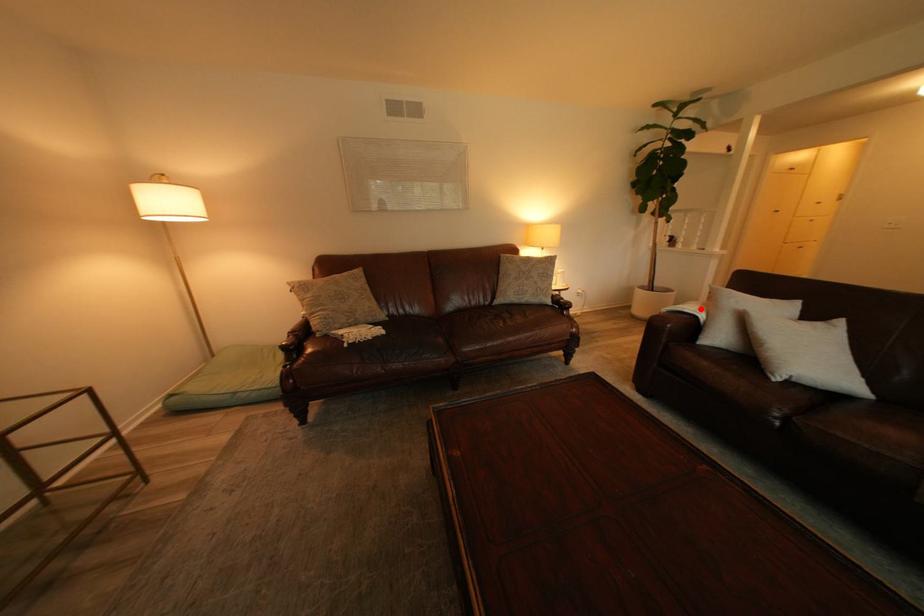
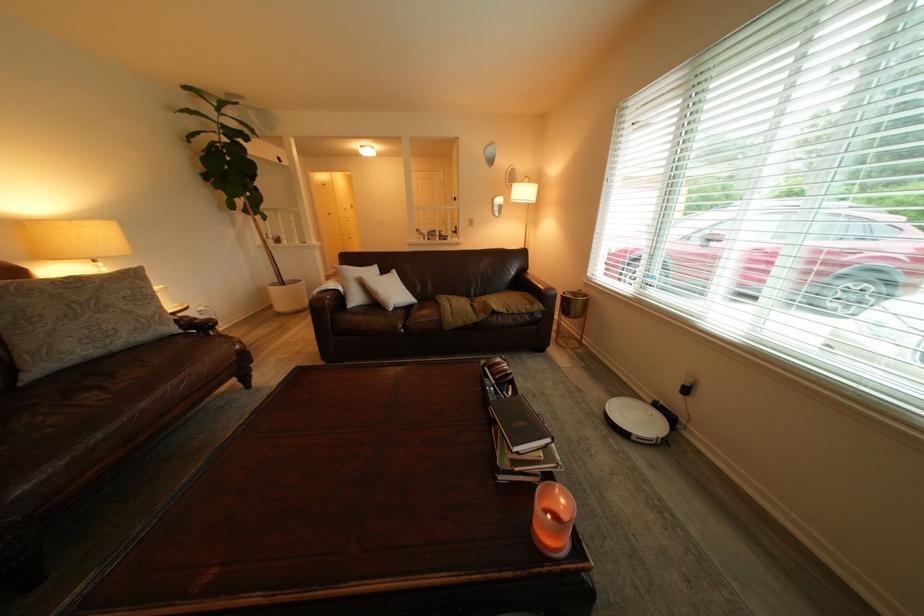
Locate, in the second image, the point that corresponds to the highlighted location in the first image.

(343, 286)